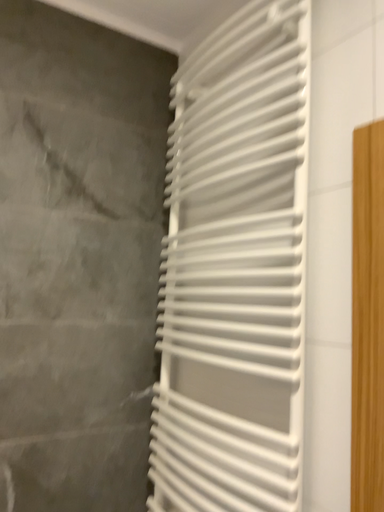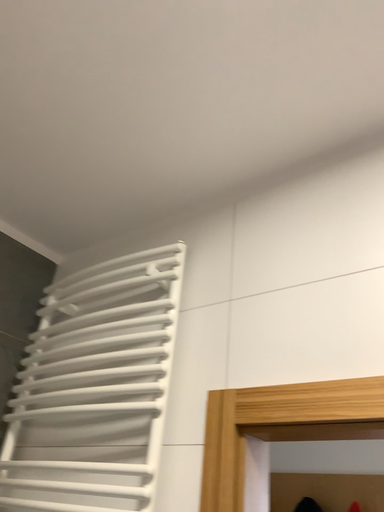
Question: How did the camera likely rotate when shooting the video?

Choices:
 (A) rotated right
 (B) rotated left

Answer: (A)